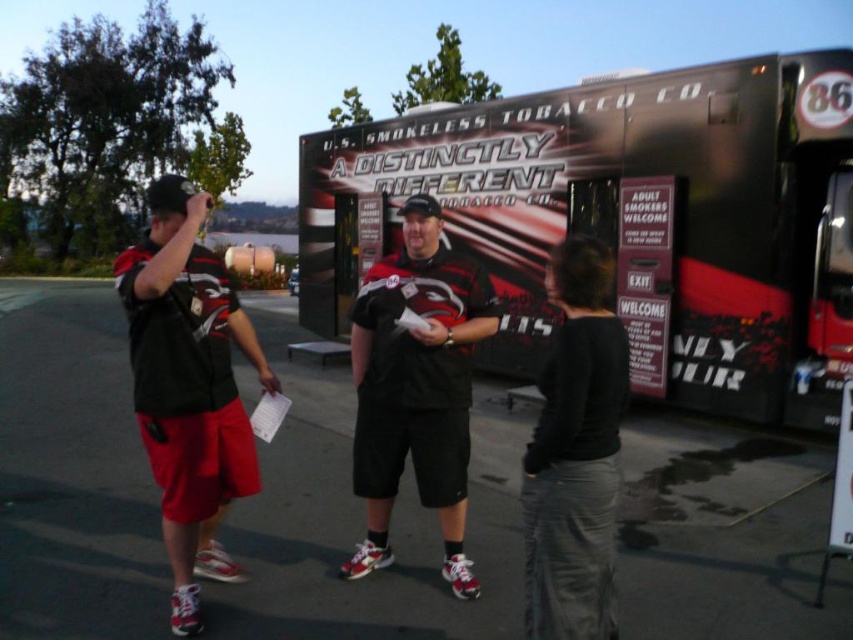
From the picture: Measure the distance between metallic silver food truck at center and black matte shirt at center.

A distance of 5.81 meters exists between metallic silver food truck at center and black matte shirt at center.

Between metallic silver food truck at center and black matte shirt at center, which one appears on the right side from the viewer's perspective?

Positioned to the right is black matte shirt at center.

Find the location of a particular element. This screenshot has width=853, height=640. metallic silver food truck at center is located at coordinates (630, 221).

Does matte black shirt at center appear on the left side of black matte shirt at center?

Correct, you'll find matte black shirt at center to the left of black matte shirt at center.

Is matte black shirt at center further to the viewer compared to black matte shirt at center?

Yes, matte black shirt at center is further from the viewer.

In the scene shown: Who is more forward, (x=379, y=426) or (x=601, y=285)?

Point (x=601, y=285)

At what (x,y) coordinates should I click in order to perform the action: click on matte black shirt at center. Please return your answer as a coordinate pair (x, y). The height and width of the screenshot is (640, 853). Looking at the image, I should click on (416, 387).

Where is `metallic silver food truck at center`? This screenshot has width=853, height=640. metallic silver food truck at center is located at coordinates (630, 221).

Can you confirm if metallic silver food truck at center is shorter than matte black shirt at center?

No, metallic silver food truck at center is not shorter than matte black shirt at center.

Which is behind, point (636, 308) or point (445, 276)?

Point (636, 308)

Locate an element on the screen. metallic silver food truck at center is located at coordinates (630, 221).